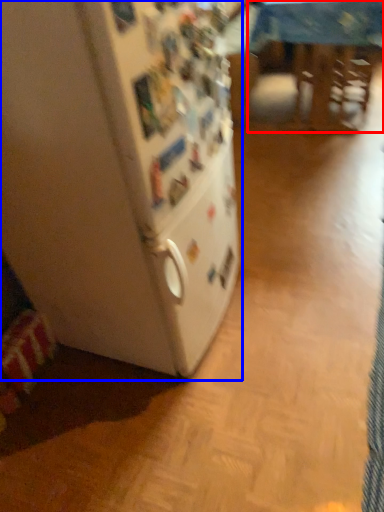
Question: Among these objects, which one is nearest to the camera, table (highlighted by a red box) or refrigerator (highlighted by a blue box)?

Choices:
 (A) table
 (B) refrigerator

Answer: (B)